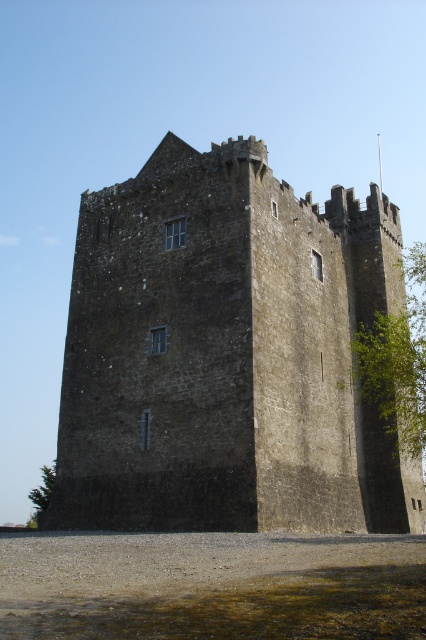
Question: Which of the following is the farthest from the observer?

Choices:
 (A) (42, 490)
 (B) (319, 515)
 (C) (383, 413)

Answer: (A)

Question: Is rustic stone tower at center to the left of green leafy tree at lower left from the viewer's perspective?

Choices:
 (A) yes
 (B) no

Answer: (B)

Question: Does rustic stone tower at center appear on the right side of green leafy tree at right?

Choices:
 (A) yes
 (B) no

Answer: (B)

Question: Does rustic stone tower at center appear on the left side of green leafy tree at right?

Choices:
 (A) no
 (B) yes

Answer: (B)

Question: Estimate the real-world distances between objects in this image. Which object is farther from the rustic stone tower at center?

Choices:
 (A) green leafy tree at right
 (B) green leafy tree at lower left

Answer: (B)

Question: Among these objects, which one is farthest from the camera?

Choices:
 (A) green leafy tree at right
 (B) rustic stone tower at center
 (C) green leafy tree at lower left

Answer: (C)